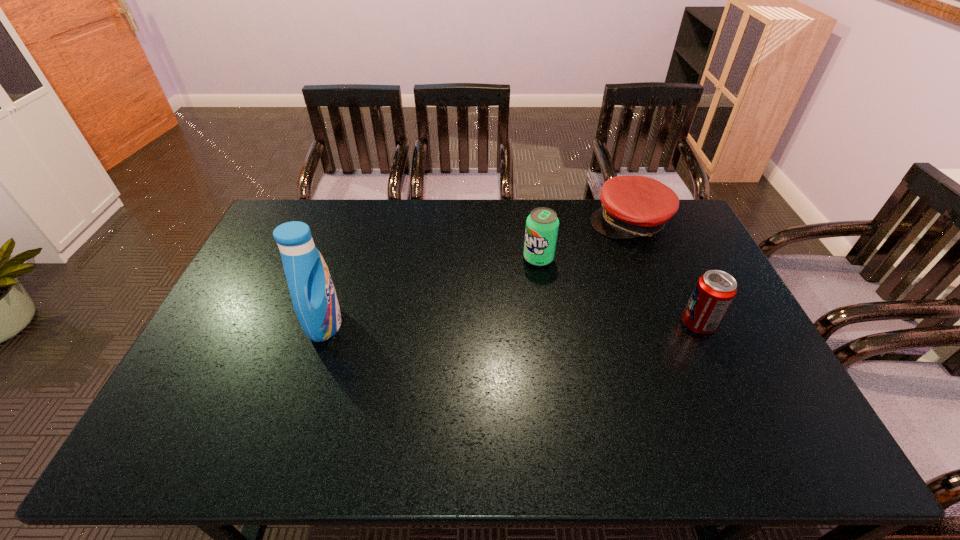
Image resolution: width=960 pixels, height=540 pixels. Identify the location of free space on the desktop that is between the detergent and the nearer pop soda and is positioned on the front-facing side of the third nearest object. (x=483, y=324).

I want to click on vacant space on the desktop that is between the leftmost object and the nearer pop soda and is positioned at the front of the cap where the visor is located, so click(559, 324).